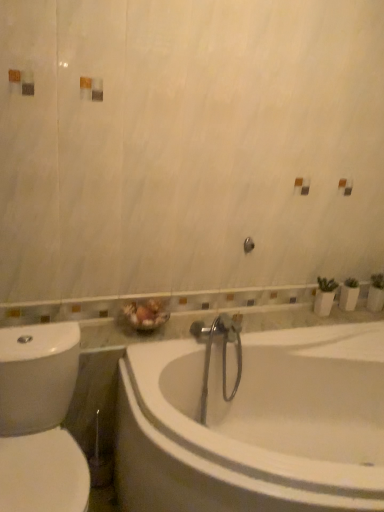
Question: Considering the positions of white glossy bathtub at center and white glossy toilet at left in the image, is white glossy bathtub at center taller or shorter than white glossy toilet at left?

Choices:
 (A) short
 (B) tall

Answer: (A)

Question: Is point (261, 463) closer or farther from the camera than point (64, 349)?

Choices:
 (A) closer
 (B) farther

Answer: (A)

Question: Is white glossy bathtub at center bigger or smaller than white glossy toilet at left?

Choices:
 (A) small
 (B) big

Answer: (B)

Question: Based on their positions, is white glossy toilet at left located to the left or right of white glossy bathtub at center?

Choices:
 (A) right
 (B) left

Answer: (B)

Question: Is point (13, 430) closer or farther from the camera than point (147, 494)?

Choices:
 (A) closer
 (B) farther

Answer: (B)

Question: From the image's perspective, is white glossy toilet at left above or below white glossy bathtub at center?

Choices:
 (A) below
 (B) above

Answer: (B)

Question: Is white glossy toilet at left situated inside white glossy bathtub at center or outside?

Choices:
 (A) outside
 (B) inside

Answer: (A)